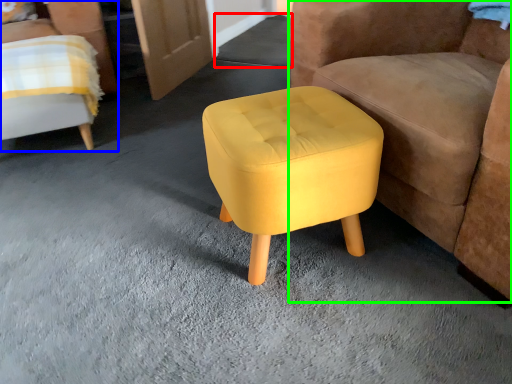
Question: Which is farther away from concrete (highlighted by a red box)? chair (highlighted by a blue box) or chair (highlighted by a green box)?

Choices:
 (A) chair
 (B) chair

Answer: (B)